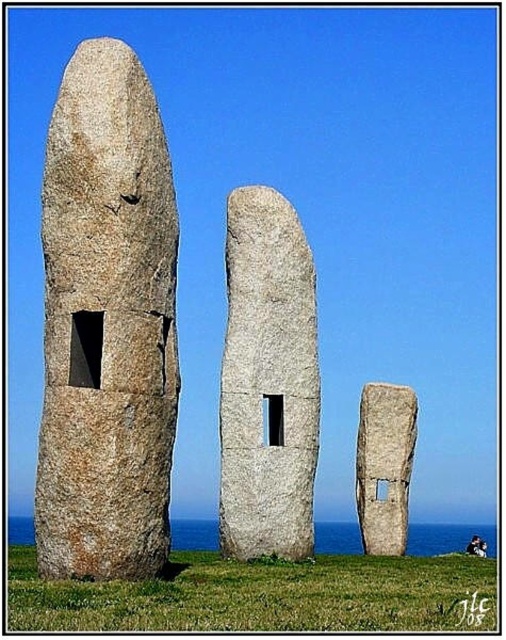
Is gray stone monolith at center to the right of smooth gray stone at center from the viewer's perspective?

No, gray stone monolith at center is not to the right of smooth gray stone at center.

The height and width of the screenshot is (640, 506). What do you see at coordinates (268, 381) in the screenshot?
I see `gray stone monolith at center` at bounding box center [268, 381].

Based on the photo, who is more distant from viewer, (300, 552) or (393, 509)?

Point (393, 509)

Where is `gray stone monolith at center`? This screenshot has width=506, height=640. gray stone monolith at center is located at coordinates (268, 381).

Measure the distance between granite stone at left and smooth gray stone at center.

granite stone at left is 48.26 meters away from smooth gray stone at center.

Does granite stone at left appear under smooth gray stone at center?

No, granite stone at left is not below smooth gray stone at center.

Where is `granite stone at left`? The image size is (506, 640). granite stone at left is located at coordinates (106, 324).

Where is `granite stone at left`? granite stone at left is located at coordinates (106, 324).

Is granite stone at left bigger than gray stone monolith at center?

Yes.

Which is above, granite stone at left or gray stone monolith at center?

granite stone at left is higher up.

Is point (108, 451) behind point (270, 204)?

No, it is not.

Locate an element on the screen. The image size is (506, 640). granite stone at left is located at coordinates (106, 324).